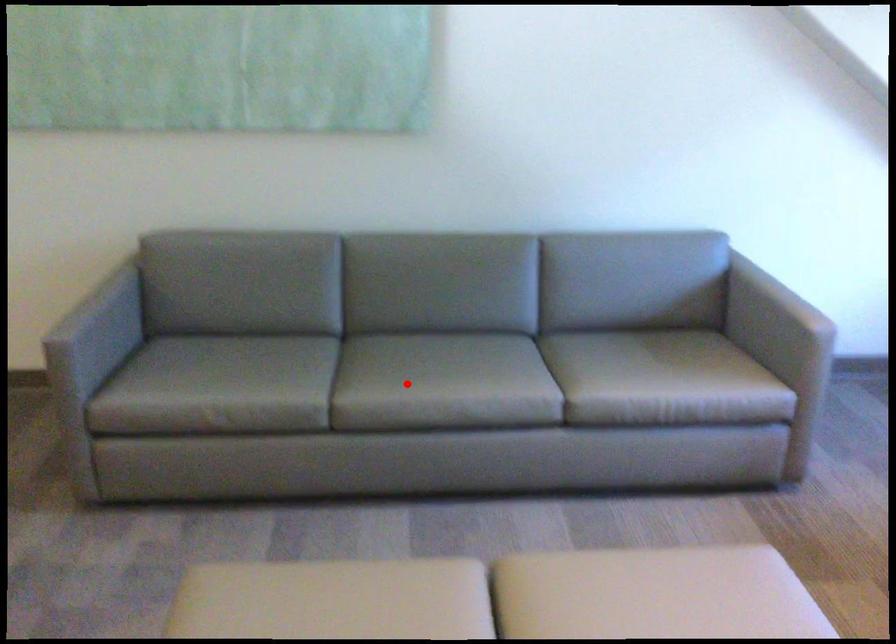
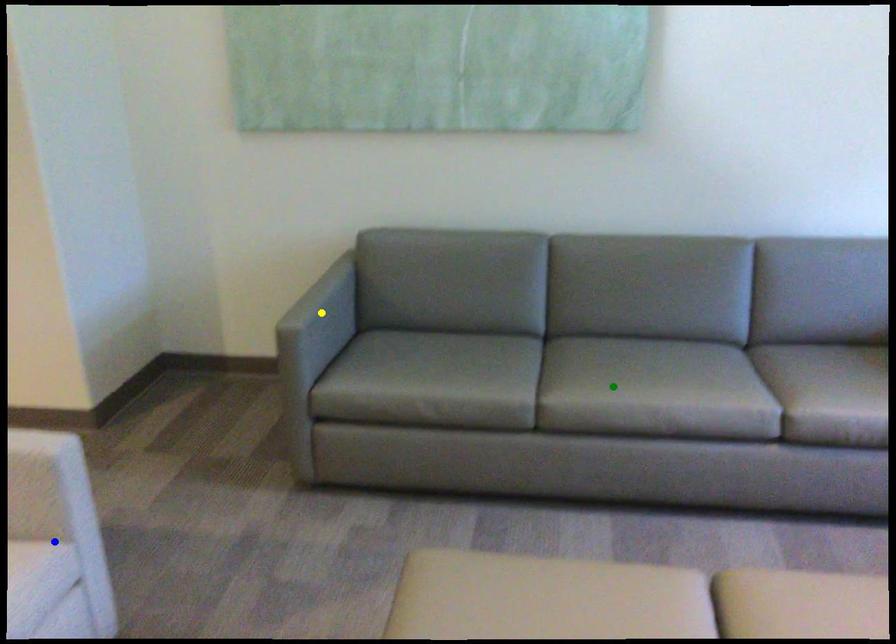
Question: I am providing you with two images of the same scene from different viewpoints. A red point is marked on the first image. You are given multiple points on the second image. Which mark in image 2 goes with the point in image 1?

Choices:
 (A) blue point
 (B) yellow point
 (C) green point

Answer: (C)